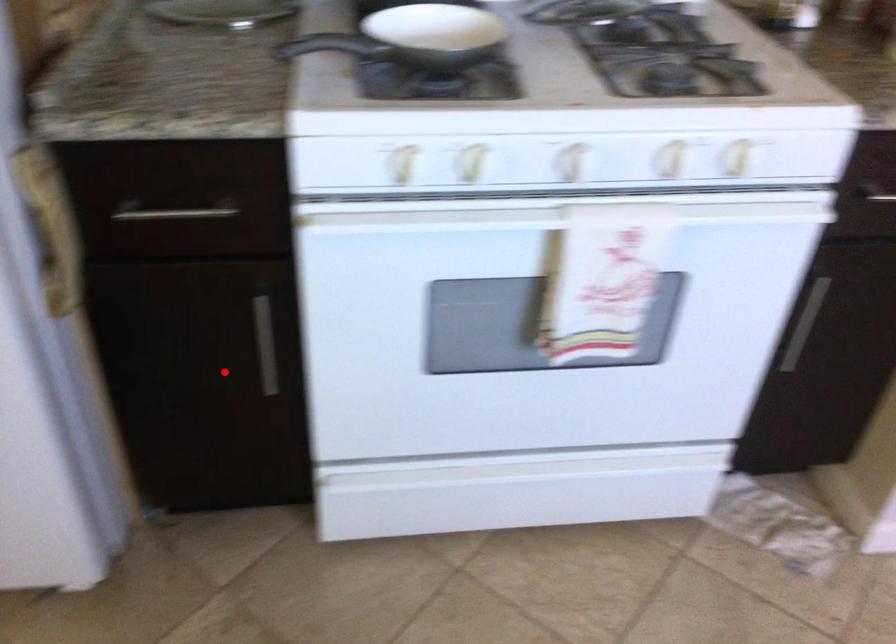
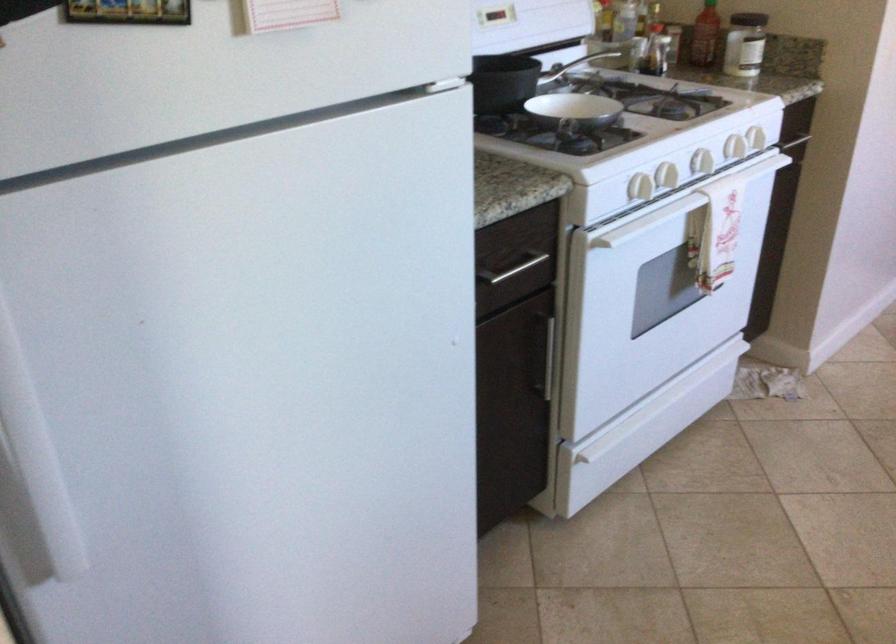
In the second image, find the point that corresponds to the highlighted location in the first image.

(549, 359)